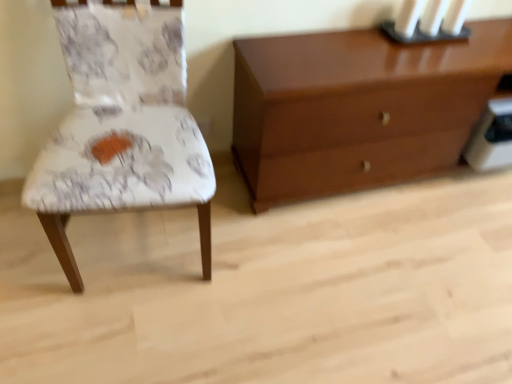
Where is `white fabric chair at left`? Image resolution: width=512 pixels, height=384 pixels. white fabric chair at left is located at coordinates (121, 124).

Which object is more forward, white fabric chair at left or glossy wood chest of drawers at upper right?

Positioned in front is white fabric chair at left.

This screenshot has width=512, height=384. What are the coordinates of `chest of drawers to the right of white fabric chair at left` in the screenshot? It's located at (358, 108).

Considering the positions of objects black matte candle holder at upper right and glossy wood chest of drawers at upper right in the image provided, who is in front, black matte candle holder at upper right or glossy wood chest of drawers at upper right?

glossy wood chest of drawers at upper right is more forward.

Considering the sizes of objects black matte candle holder at upper right and glossy wood chest of drawers at upper right in the image provided, who is taller, black matte candle holder at upper right or glossy wood chest of drawers at upper right?

Standing taller between the two is glossy wood chest of drawers at upper right.

Do you think black matte candle holder at upper right is within glossy wood chest of drawers at upper right, or outside of it?

black matte candle holder at upper right is inside glossy wood chest of drawers at upper right.

Are black matte candle holder at upper right and glossy wood chest of drawers at upper right making contact?

No, black matte candle holder at upper right is not in contact with glossy wood chest of drawers at upper right.

From the image's perspective, is white fabric chair at left under black matte candle holder at upper right?

Yes, from the image's perspective, white fabric chair at left is beneath black matte candle holder at upper right.

Would you say white fabric chair at left is to the left or to the right of black matte candle holder at upper right in the picture?

white fabric chair at left is to the left of black matte candle holder at upper right.

Between point (133, 133) and point (462, 35), which one is positioned behind?

Point (462, 35)

From a real-world perspective, does white fabric chair at left sit lower than black matte candle holder at upper right?

Yes.

Is glossy wood chest of drawers at upper right positioned with its back to white fabric chair at left?

No, glossy wood chest of drawers at upper right is not facing away from white fabric chair at left.

Does glossy wood chest of drawers at upper right have a greater width compared to white fabric chair at left?

No, glossy wood chest of drawers at upper right is not wider than white fabric chair at left.

Who is shorter, glossy wood chest of drawers at upper right or white fabric chair at left?

glossy wood chest of drawers at upper right.

Considering the sizes of objects black matte candle holder at upper right and white fabric chair at left in the image provided, who is shorter, black matte candle holder at upper right or white fabric chair at left?

With less height is black matte candle holder at upper right.

Considering the sizes of objects black matte candle holder at upper right and white fabric chair at left in the image provided, who is bigger, black matte candle holder at upper right or white fabric chair at left?

With larger size is white fabric chair at left.

Is black matte candle holder at upper right oriented towards white fabric chair at left?

No, black matte candle holder at upper right is not oriented towards white fabric chair at left.

Would you say black matte candle holder at upper right is inside or outside white fabric chair at left?

black matte candle holder at upper right is outside white fabric chair at left.

Can you confirm if glossy wood chest of drawers at upper right is positioned to the left of black matte candle holder at upper right?

Indeed, glossy wood chest of drawers at upper right is positioned on the left side of black matte candle holder at upper right.

Is glossy wood chest of drawers at upper right looking in the opposite direction of black matte candle holder at upper right?

No, glossy wood chest of drawers at upper right is not facing away from black matte candle holder at upper right.

Is the surface of glossy wood chest of drawers at upper right in direct contact with black matte candle holder at upper right?

No, glossy wood chest of drawers at upper right is not making contact with black matte candle holder at upper right.

In order to click on chest of drawers behind the white fabric chair at left in this screenshot , I will do `click(358, 108)`.

This screenshot has height=384, width=512. Find the location of `chest of drawers to the left of black matte candle holder at upper right`. chest of drawers to the left of black matte candle holder at upper right is located at coordinates (358, 108).

From the image, which object appears to be farther from white fabric chair at left, black matte candle holder at upper right or glossy wood chest of drawers at upper right?

The object further to white fabric chair at left is black matte candle holder at upper right.

When comparing their distances from white fabric chair at left, does glossy wood chest of drawers at upper right or black matte candle holder at upper right seem further?

The object further to white fabric chair at left is black matte candle holder at upper right.

From the picture: Looking at the image, which one is located further to black matte candle holder at upper right, white fabric chair at left or glossy wood chest of drawers at upper right?

Among the two, white fabric chair at left is located further to black matte candle holder at upper right.

Consider the image. When comparing their distances from glossy wood chest of drawers at upper right, does black matte candle holder at upper right or white fabric chair at left seem closer?

black matte candle holder at upper right is positioned closer to the anchor glossy wood chest of drawers at upper right.

Based on their spatial positions, is white fabric chair at left or black matte candle holder at upper right closer to glossy wood chest of drawers at upper right?

The object closer to glossy wood chest of drawers at upper right is black matte candle holder at upper right.

Based on their spatial positions, is glossy wood chest of drawers at upper right or white fabric chair at left further from black matte candle holder at upper right?

white fabric chair at left is positioned further to the anchor black matte candle holder at upper right.

Where is `chest of drawers between white fabric chair at left and black matte candle holder at upper right from left to right`? This screenshot has width=512, height=384. chest of drawers between white fabric chair at left and black matte candle holder at upper right from left to right is located at coordinates (358, 108).